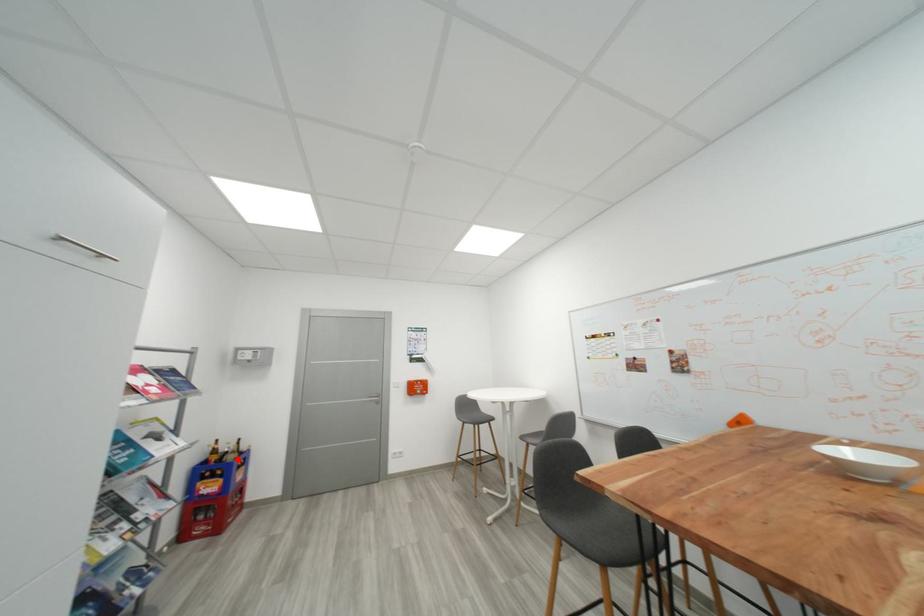
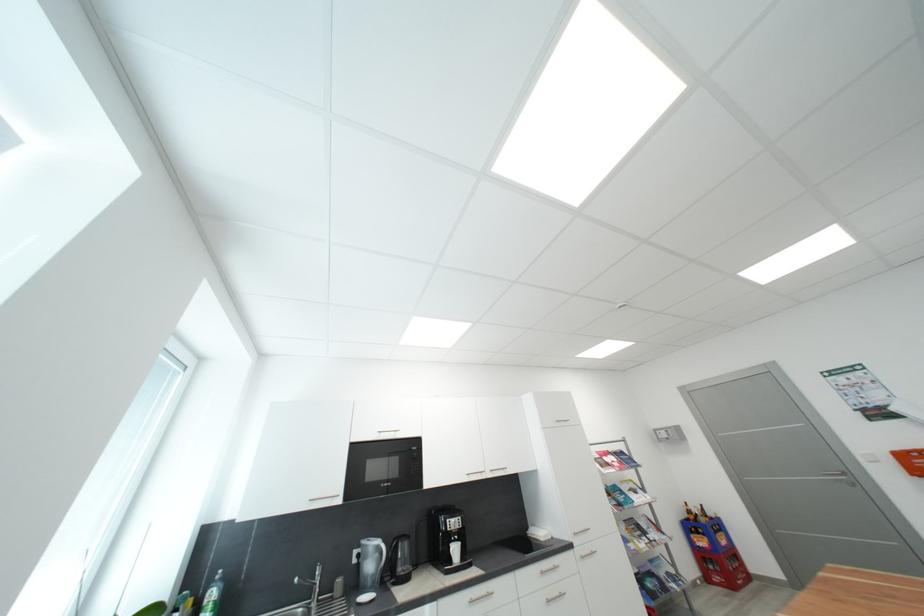
The point at the highlighted location is marked in the first image. Where is the corresponding point in the second image?

(710, 522)